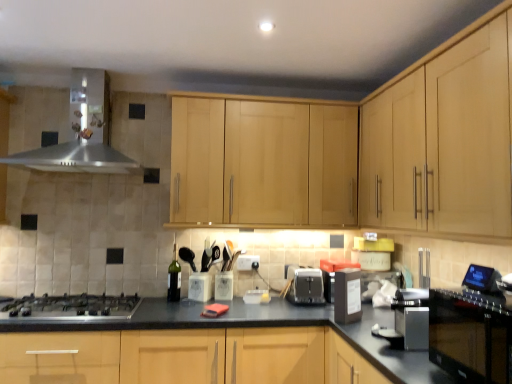
In order to click on spots to the right of green glass bottle at center in this screenshot , I will do `click(195, 301)`.